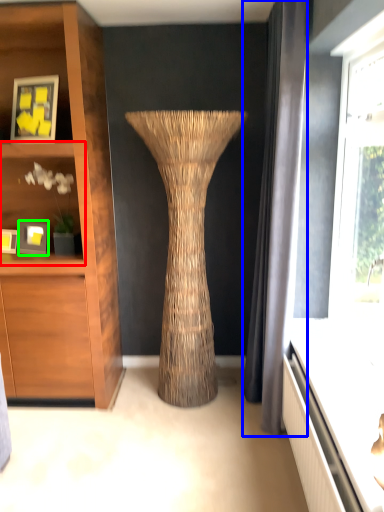
Question: Which object is the farthest from shelf (highlighted by a red box)? Choose among these: curtain (highlighted by a blue box) or picture frame (highlighted by a green box).

Choices:
 (A) curtain
 (B) picture frame

Answer: (A)